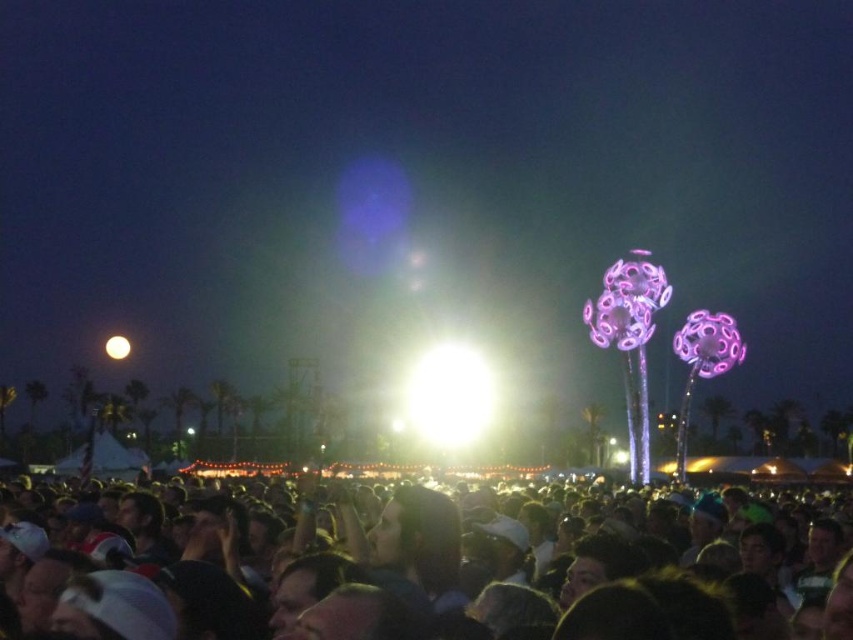
You are a photographer trying to capture the crowd at the concert. You want to focus on the dark matte crowd at center. Where should you point your camera to capture them?

You should point your camera to the coordinates point at point at point at point at point at point at point at point at point at point at point at point at point at point at point at point at point at point at point at point at point at point at point at point at point at point at point at point at point at point at point at point at point at point at point at point at point at point at point at point at point at point at point at point at point at point at point at point at point at point at point at point

You are a photographer at the concert and want to capture a photo of the bright white sphere at upper center without the dark matte crowd at center blocking it. Is it possible to adjust your camera angle to achieve this?

The dark matte crowd at center is much taller than the bright white sphere at upper center, so adjusting the camera angle downward might allow you to frame the bright white sphere at upper center while avoiding the crowd.